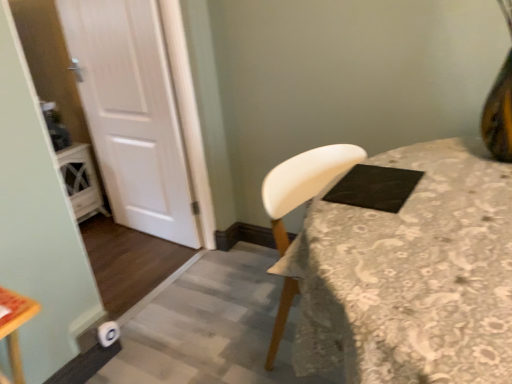
Question: Does white fabric-covered table at center appear on the right side of black matte pad at upper right?

Choices:
 (A) yes
 (B) no

Answer: (B)

Question: Can you confirm if white fabric-covered table at center is thinner than black matte pad at upper right?

Choices:
 (A) no
 (B) yes

Answer: (A)

Question: Can you confirm if white fabric-covered table at center is wider than black matte pad at upper right?

Choices:
 (A) yes
 (B) no

Answer: (A)

Question: Could you tell me if white fabric-covered table at center is turned towards black matte pad at upper right?

Choices:
 (A) yes
 (B) no

Answer: (B)

Question: Can you confirm if white fabric-covered table at center is shorter than black matte pad at upper right?

Choices:
 (A) no
 (B) yes

Answer: (A)

Question: Considering the relative positions of white fabric-covered table at center and black matte pad at upper right in the image provided, is white fabric-covered table at center behind black matte pad at upper right?

Choices:
 (A) yes
 (B) no

Answer: (B)

Question: From a real-world perspective, does black matte pad at upper right sit lower than white fabric-covered table at center?

Choices:
 (A) yes
 (B) no

Answer: (B)

Question: Is black matte pad at upper right at the right side of white fabric-covered table at center?

Choices:
 (A) yes
 (B) no

Answer: (A)

Question: From the image's perspective, is black matte pad at upper right on top of white fabric-covered table at center?

Choices:
 (A) yes
 (B) no

Answer: (A)

Question: Can you confirm if black matte pad at upper right is taller than white fabric-covered table at center?

Choices:
 (A) no
 (B) yes

Answer: (A)

Question: Does black matte pad at upper right have a lesser width compared to white fabric-covered table at center?

Choices:
 (A) no
 (B) yes

Answer: (B)

Question: Does black matte pad at upper right have a lesser height compared to white fabric-covered table at center?

Choices:
 (A) no
 (B) yes

Answer: (B)

Question: Could you tell me if black matte pad at upper right is turned towards white wood door at left?

Choices:
 (A) no
 (B) yes

Answer: (A)